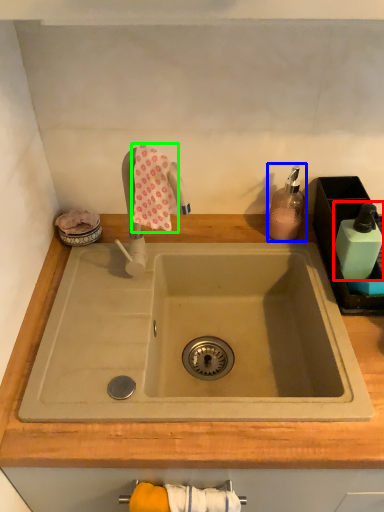
Question: Based on their relative distances, which object is nearer to toiletry (highlighted by a red box)? Choose from soap dispenser (highlighted by a blue box) and bath towel (highlighted by a green box).

Choices:
 (A) soap dispenser
 (B) bath towel

Answer: (A)